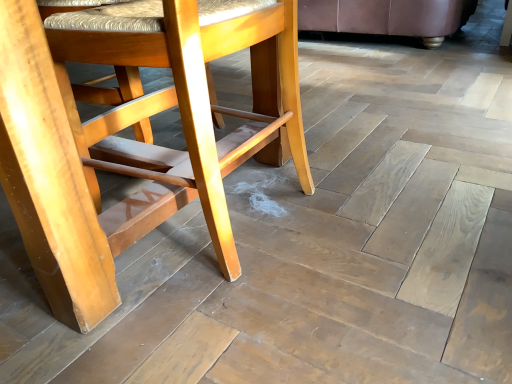
Question: From the image's perspective, is light brown wood chair at center, which ranks as the 1th chair in front-to-back order, above or below wooden chair at upper right, acting as the 1th chair starting from the top?

Choices:
 (A) below
 (B) above

Answer: (A)

Question: In the image, is light brown wood chair at center, the first chair from the bottom, on the left side or the right side of wooden chair at upper right, positioned as the second chair in bottom-to-top order?

Choices:
 (A) left
 (B) right

Answer: (A)

Question: From their relative heights in the image, would you say light brown wood chair at center, which is counted as the second chair, starting from the back, is taller or shorter than wooden chair at upper right, which appears as the 2th chair when viewed from the front?

Choices:
 (A) tall
 (B) short

Answer: (A)

Question: Which is correct: wooden chair at upper right, which appears as the 2th chair when viewed from the front, is inside light brown wood chair at center, which ranks as the 1th chair in front-to-back order, or outside of it?

Choices:
 (A) inside
 (B) outside

Answer: (B)

Question: Looking at their shapes, would you say wooden chair at upper right, acting as the 1th chair starting from the top, is wider or thinner than light brown wood chair at center, which ranks as the second chair in top-to-bottom order?

Choices:
 (A) thin
 (B) wide

Answer: (B)

Question: From the image's perspective, is wooden chair at upper right, which appears as the 2th chair when viewed from the front, above or below light brown wood chair at center, which ranks as the second chair in top-to-bottom order?

Choices:
 (A) below
 (B) above

Answer: (B)

Question: Considering the positions of wooden chair at upper right, positioned as the second chair in bottom-to-top order, and light brown wood chair at center, the first chair from the bottom, in the image, is wooden chair at upper right, positioned as the second chair in bottom-to-top order, bigger or smaller than light brown wood chair at center, the first chair from the bottom,?

Choices:
 (A) big
 (B) small

Answer: (A)